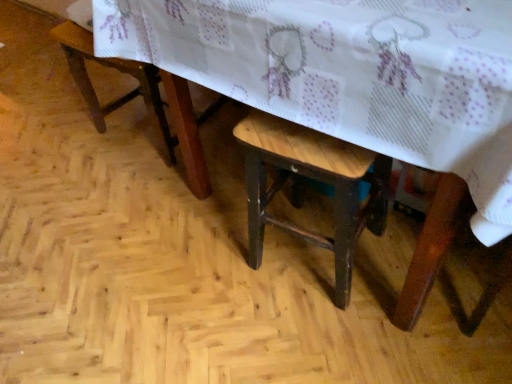
The height and width of the screenshot is (384, 512). Describe the element at coordinates (314, 179) in the screenshot. I see `wooden stool at center` at that location.

The height and width of the screenshot is (384, 512). I want to click on wooden stool at lower left, so click(x=118, y=70).

Based on their sizes in the image, would you say wooden stool at lower left is bigger or smaller than wooden stool at center?

Clearly, wooden stool at lower left is larger in size than wooden stool at center.

Visually, is wooden stool at lower left positioned to the left or to the right of wooden stool at center?

wooden stool at lower left is positioned on wooden stool at center's left side.

Considering the sizes of wooden stool at lower left and wooden stool at center in the image, is wooden stool at lower left wider or thinner than wooden stool at center?

Clearly, wooden stool at lower left has more width compared to wooden stool at center.

From the image's perspective, is wooden stool at lower left above or below wooden stool at center?

Based on their image positions, wooden stool at lower left is located above wooden stool at center.

Does wooden stool at center have a greater height compared to wooden stool at lower left?

Incorrect, the height of wooden stool at center is not larger of that of wooden stool at lower left.

Is there a large distance between wooden stool at center and wooden stool at lower left?

wooden stool at center is near wooden stool at lower left, not far away.

What's the angular difference between wooden stool at center and wooden stool at lower left's facing directions?

The angle between the facing direction of wooden stool at center and the facing direction of wooden stool at lower left is 174 degrees.

Between wooden stool at center and wooden stool at lower left, which one has larger width?

Wider between the two is wooden stool at lower left.

Which object is thinner, wooden table at center or wooden stool at lower left?

wooden stool at lower left is thinner.

Is wooden table at center at the left side of wooden stool at lower left?

No.

Does point (216, 90) come in front of point (84, 83)?

Yes, it is in front of point (84, 83).

Looking at the image, does wooden table at center seem bigger or smaller compared to wooden stool at lower left?

In the image, wooden table at center appears to be larger than wooden stool at lower left.

Which object is closer to the camera taking this photo, wooden table at center or wooden stool at center?

wooden table at center is in front.

Based on the photo, looking at their sizes, would you say wooden table at center is wider or thinner than wooden stool at center?

Considering their sizes, wooden table at center looks broader than wooden stool at center.

Based on the photo, is wooden table at center to the left or to the right of wooden stool at center in the image?

Based on their positions, wooden table at center is located to the right of wooden stool at center.

Who is shorter, wooden table at center or wooden stool at center?

wooden stool at center is shorter.

From the image's perspective, does wooden stool at center appear lower than wooden table at center?

Indeed, from the image's perspective, wooden stool at center is shown beneath wooden table at center.

Which of these two, wooden stool at center or wooden table at center, stands taller?

Standing taller between the two is wooden table at center.

Is wooden stool at center wider than wooden table at center?

Incorrect, the width of wooden stool at center does not surpass that of wooden table at center.

Consider the image. What's the angular difference between wooden stool at center and wooden table at center's facing directions?

The facing directions of wooden stool at center and wooden table at center are 8.28 degrees apart.

Is wooden stool at lower left further to the viewer compared to wooden table at center?

Yes, it is behind wooden table at center.

Which of these two, wooden stool at lower left or wooden table at center, is wider?

With larger width is wooden table at center.

Considering the positions of points (99, 58) and (489, 119), is point (99, 58) farther from camera compared to point (489, 119)?

Yes, it is.

Looking at the image, does wooden stool at lower left seem bigger or smaller compared to wooden table at center?

In the image, wooden stool at lower left appears to be smaller than wooden table at center.

The image size is (512, 384). I want to click on armchair above the wooden stool at center (from the image's perspective), so click(x=118, y=70).

I want to click on stool that is under the wooden stool at lower left (from a real-world perspective), so click(314, 179).

Based on their spatial positions, is wooden table at center or wooden stool at lower left closer to wooden stool at center?

wooden table at center lies closer to wooden stool at center than the other object.

Estimate the real-world distances between objects in this image. Which object is closer to wooden table at center, wooden stool at center or wooden stool at lower left?

Based on the image, wooden stool at center appears to be nearer to wooden table at center.

When comparing their distances from wooden table at center, does wooden stool at lower left or wooden stool at center seem closer?

Among the two, wooden stool at center is located nearer to wooden table at center.

When comparing their distances from wooden stool at center, does wooden stool at lower left or wooden table at center seem further?

Among the two, wooden stool at lower left is located further to wooden stool at center.

Considering their positions, is wooden stool at center positioned closer to wooden stool at lower left than wooden table at center?

wooden table at center is positioned closer to the anchor wooden stool at lower left.

Based on their spatial positions, is wooden table at center or wooden stool at center closer to wooden stool at lower left?

wooden table at center.

Find the location of `stool between wooden stool at lower left and wooden table at center in the horizontal direction`. stool between wooden stool at lower left and wooden table at center in the horizontal direction is located at coordinates 314,179.